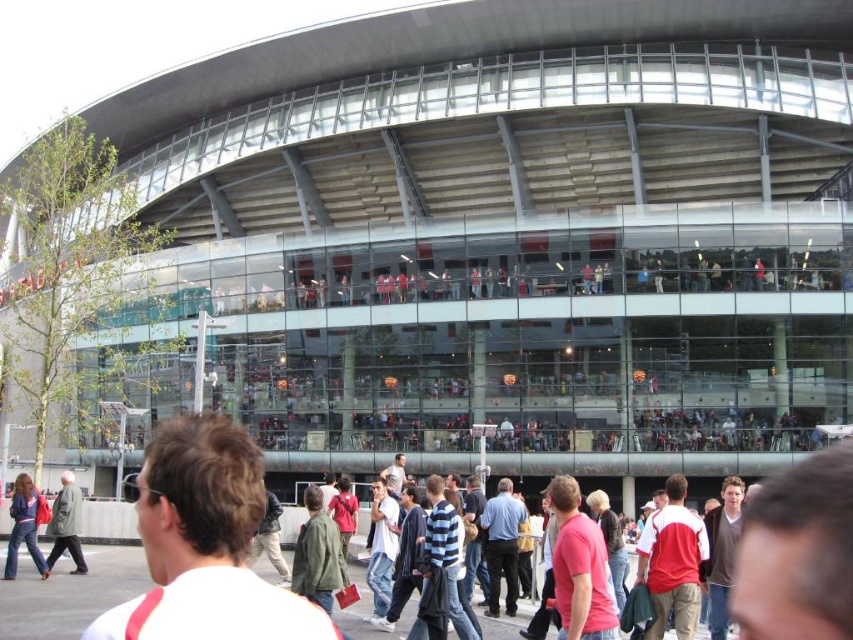
Question: From the image, what is the correct spatial relationship of white matte shirt at center in relation to green matte coat at lower left?

Choices:
 (A) below
 (B) above

Answer: (B)

Question: In this image, where is denim jacket at lower left located relative to green matte coat at lower left?

Choices:
 (A) above
 (B) below

Answer: (A)

Question: Which point is closer to the camera?

Choices:
 (A) white matte shirt at center
 (B) denim jacket at lower left

Answer: (A)

Question: Which object is positioned closest to the white matte shirt at center?

Choices:
 (A) denim jacket at lower left
 (B) green matte coat at lower left

Answer: (A)

Question: Is the position of white matte shirt at center more distant than that of denim jacket at lower left?

Choices:
 (A) no
 (B) yes

Answer: (A)

Question: Which is farther from the denim jacket at lower left?

Choices:
 (A) white matte shirt at center
 (B) green matte coat at lower left

Answer: (A)